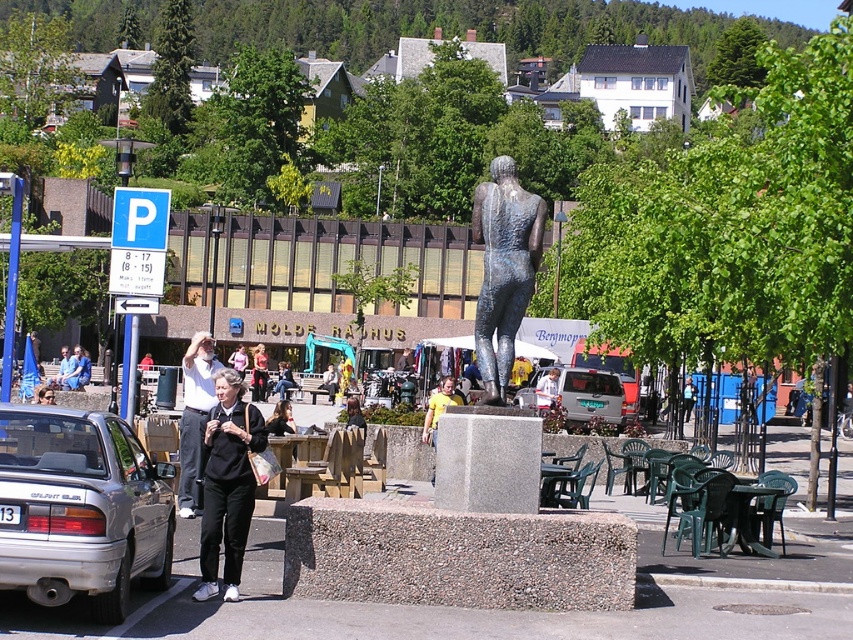
Question: Among these objects, which one is farthest from the camera?

Choices:
 (A) light gray pants at center
 (B) silver metallic car at lower left

Answer: (A)

Question: Does silver metallic car at lower left appear under matte black jacket at left?

Choices:
 (A) yes
 (B) no

Answer: (B)

Question: Is silver metallic car at lower left smaller than matte black jacket at left?

Choices:
 (A) yes
 (B) no

Answer: (A)

Question: Based on their relative distances, which object is nearer to the black fabric at left?

Choices:
 (A) shiny bronze statue at center
 (B) light gray pants at center
 (C) matte black dress at center
 (D) matte black jacket at center

Answer: (B)

Question: Can you confirm if silver metallic car at lower left is positioned to the left of matte black dress at center?

Choices:
 (A) no
 (B) yes

Answer: (A)

Question: Which point is closer to the camera?

Choices:
 (A) (178, 493)
 (B) (151, 528)

Answer: (B)